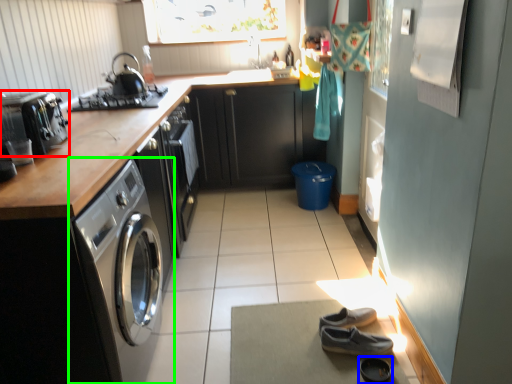
Question: Which is nearer to the home appliance (highlighted by a red box)? shoe (highlighted by a blue box) or washing machine (highlighted by a green box).

Choices:
 (A) shoe
 (B) washing machine

Answer: (B)